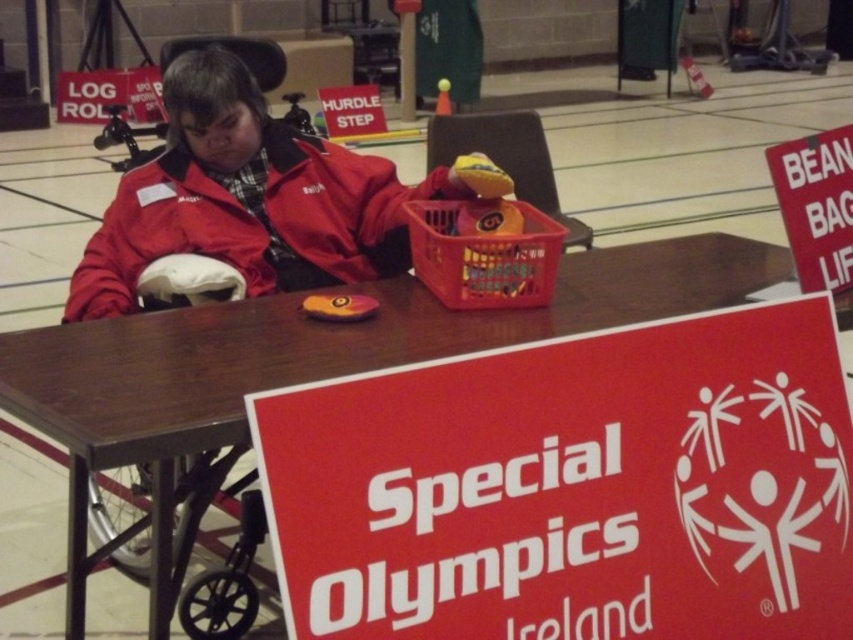
Does brown wooden table at center lie behind plastic basket at center?

No, it is not.

Which is more to the left, brown wooden table at center or plastic basket at center?

From the viewer's perspective, plastic basket at center appears more on the left side.

Where is `brown wooden table at center`? Image resolution: width=853 pixels, height=640 pixels. brown wooden table at center is located at coordinates (311, 360).